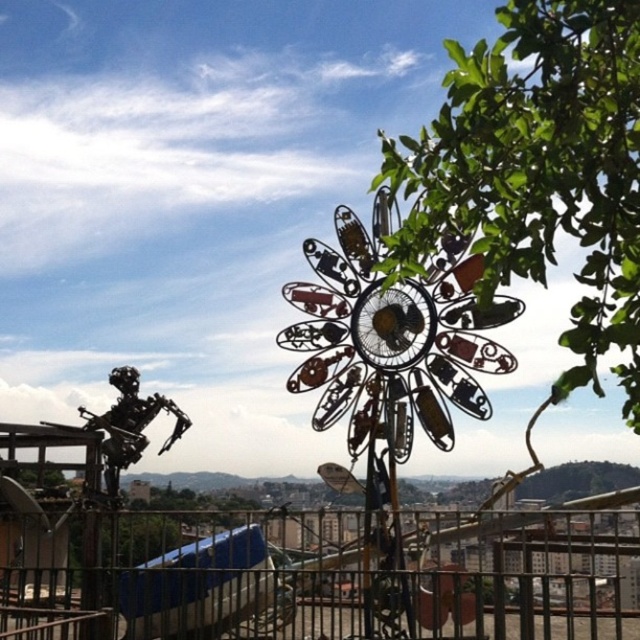
Question: Is green leafy tree at upper right further to the viewer compared to metallic robot at lower left?

Choices:
 (A) yes
 (B) no

Answer: (B)

Question: Which point is farther from the camera taking this photo?

Choices:
 (A) (122, 432)
 (B) (204, 534)
 (C) (541, 268)

Answer: (A)

Question: Can you confirm if metallic at lower center is wider than metallic robot at lower left?

Choices:
 (A) no
 (B) yes

Answer: (B)

Question: Is green leafy tree at upper right thinner than metallic robot at lower left?

Choices:
 (A) no
 (B) yes

Answer: (A)

Question: Estimate the real-world distances between objects in this image. Which object is farther from the green leafy tree at upper right?

Choices:
 (A) metallic at lower center
 (B) metallic robot at lower left

Answer: (B)

Question: Which object appears farthest from the camera in this image?

Choices:
 (A) green leafy tree at upper right
 (B) metallic at lower center

Answer: (B)